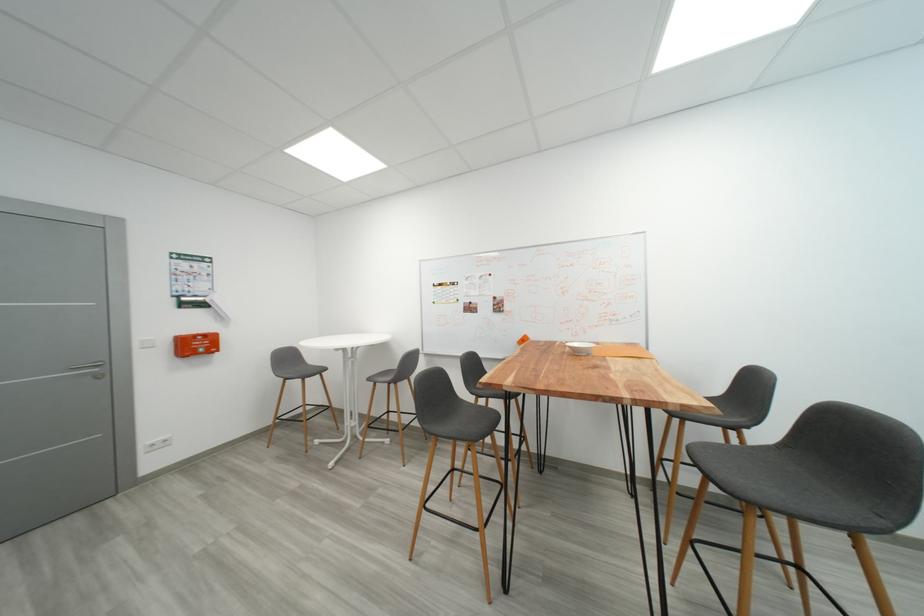
This screenshot has height=616, width=924. What do you see at coordinates (196, 344) in the screenshot? I see `the first aid kit latch` at bounding box center [196, 344].